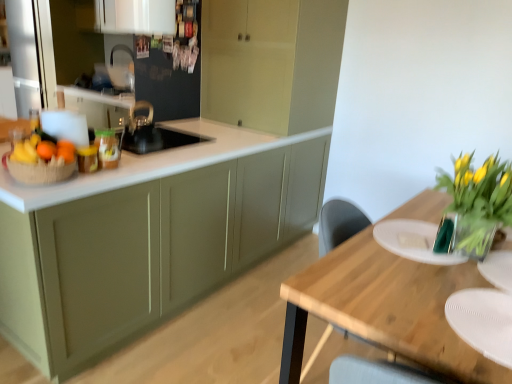
Locate an element on the screen. This screenshot has width=512, height=384. vacant area that is in front of orange matte at left is located at coordinates (36, 184).